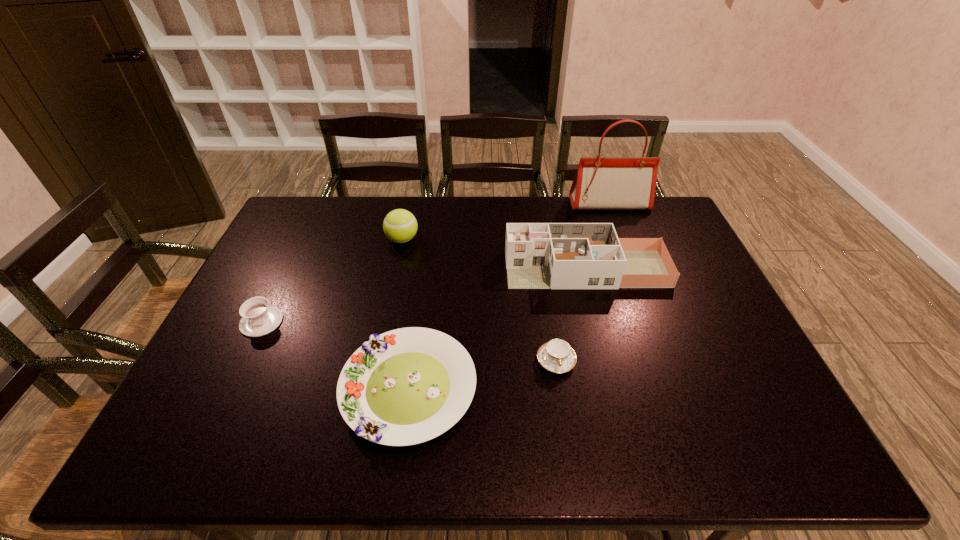
This screenshot has width=960, height=540. Identify the location of the tallest object. 617,183.

Identify the location of handbag. Image resolution: width=960 pixels, height=540 pixels. (617, 183).

Where is `tennis ball`? The image size is (960, 540). tennis ball is located at coordinates (400, 226).

Where is `the fourth nearest object`? the fourth nearest object is located at coordinates (538, 255).

At what (x,y) coordinates should I click in order to perform the action: click on the leftmost object. Please return your answer as a coordinate pair (x, y). The height and width of the screenshot is (540, 960). Looking at the image, I should click on (258, 318).

Find the location of a particular element. The height and width of the screenshot is (540, 960). the left teacup is located at coordinates (258, 318).

Identify the location of the nearer teacup. (557, 356).

The image size is (960, 540). What are the coordinates of `salad plate` in the screenshot? It's located at (406, 386).

The image size is (960, 540). Find the location of `vacant region located on the front of the tallest object`. vacant region located on the front of the tallest object is located at coordinates [619, 228].

You are a GUI agent. You are given a task and a screenshot of the screen. Output one action in this format:
    pyautogui.click(x=<x>, y=<y>)
    Task: Click on the free space located on the front of the fifth nearest object
    
    Given the screenshot: What is the action you would take?
    pyautogui.click(x=397, y=264)